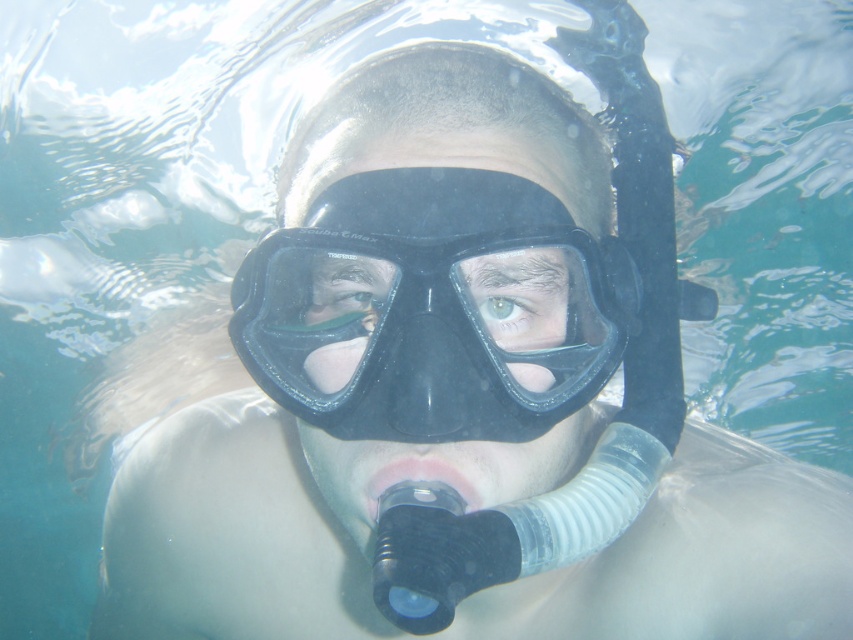
Question: From the image, what is the correct spatial relationship of black rubber goggles at center in relation to green matte eye at center?

Choices:
 (A) above
 (B) below

Answer: (A)

Question: Does black rubber goggles at center appear over green matte eye at center?

Choices:
 (A) yes
 (B) no

Answer: (A)

Question: Is black rubber goggles at center above green matte eye at center?

Choices:
 (A) no
 (B) yes

Answer: (B)

Question: Which of the following is the closest to the observer?

Choices:
 (A) (488, 298)
 (B) (390, 262)

Answer: (B)

Question: Which point is closer to the camera?

Choices:
 (A) green matte eye at center
 (B) black rubber goggles at center

Answer: (B)